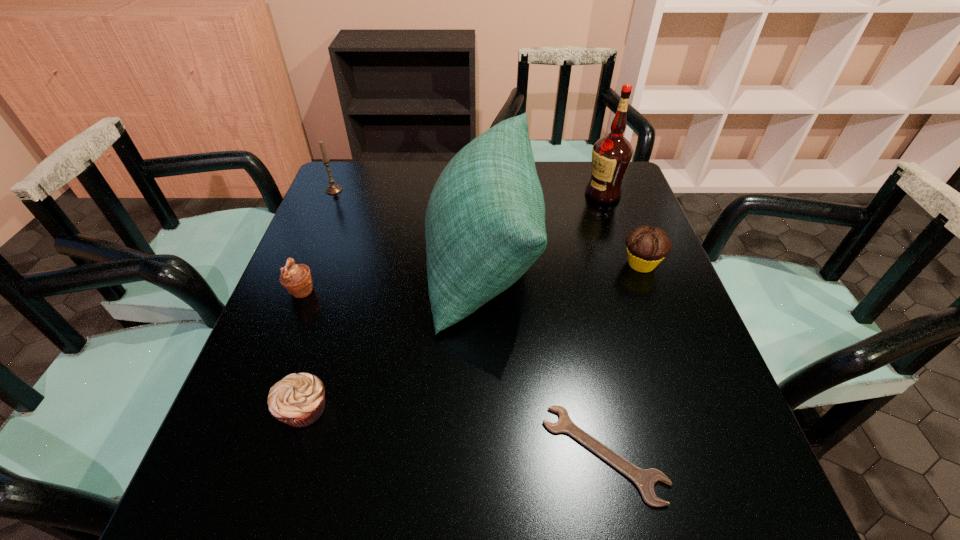
Identify the location of cushion present at the far edge. (485, 220).

You are a GUI agent. You are given a task and a screenshot of the screen. Output one action in this format:
    pyautogui.click(x=<x>, y=<y>)
    Task: Click on the candle that is at the far edge
    This screenshot has height=540, width=960.
    Given the screenshot: What is the action you would take?
    pyautogui.click(x=333, y=188)

At what (x,y) coordinates should I click in order to perform the action: click on object present at the near edge. Please return your answer as a coordinate pair (x, y). The height and width of the screenshot is (540, 960). Looking at the image, I should click on (645, 479).

In order to click on candle that is at the left edge in this screenshot , I will do `click(333, 188)`.

Where is `alcohol that is at the right edge`? The image size is (960, 540). alcohol that is at the right edge is located at coordinates (611, 155).

At what (x,y) coordinates should I click in order to perform the action: click on muffin present at the right edge. Please return your answer as a coordinate pair (x, y). The height and width of the screenshot is (540, 960). Looking at the image, I should click on (647, 246).

I want to click on wrench situated at the right edge, so click(x=645, y=479).

The width and height of the screenshot is (960, 540). What are the coordinates of `object at the far left corner` in the screenshot? It's located at (333, 188).

You are a GUI agent. You are given a task and a screenshot of the screen. Output one action in this format:
    pyautogui.click(x=<x>, y=<y>)
    Task: Click on the object located in the far right corner section of the desktop
    Image resolution: width=960 pixels, height=540 pixels.
    Given the screenshot: What is the action you would take?
    pyautogui.click(x=611, y=155)

Where is `object that is positioned at the near right corner`? This screenshot has width=960, height=540. object that is positioned at the near right corner is located at coordinates (645, 479).